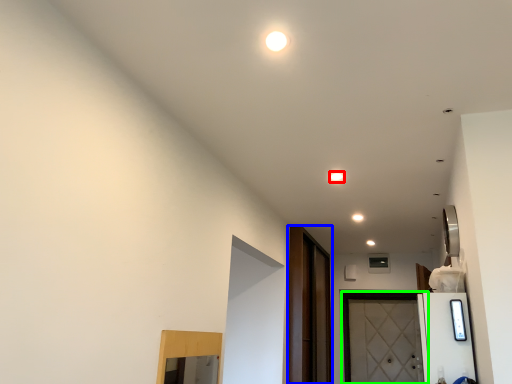
Question: Which object is positioned closest to light (highlighted by a red box)? Select from screen door (highlighted by a blue box) and door (highlighted by a green box).

Choices:
 (A) screen door
 (B) door

Answer: (A)